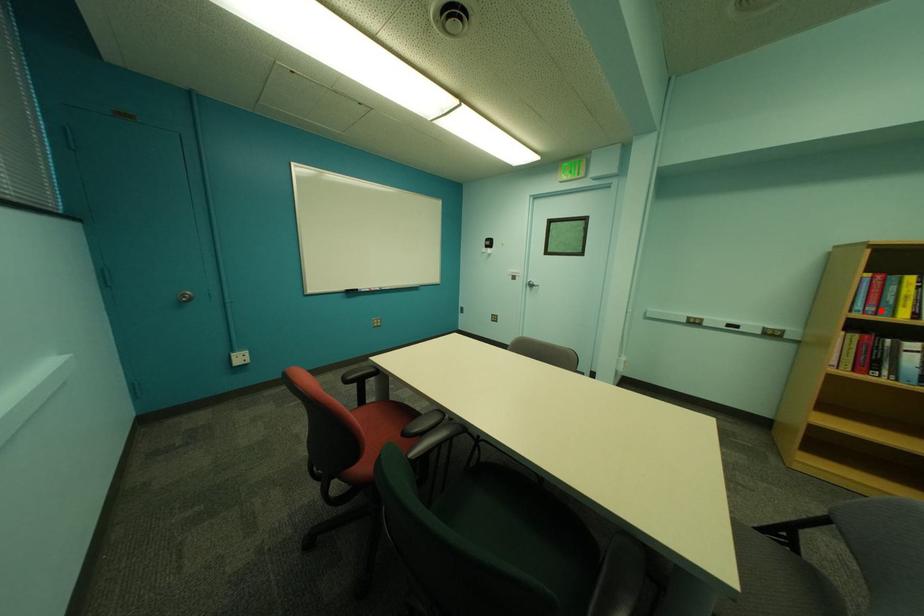
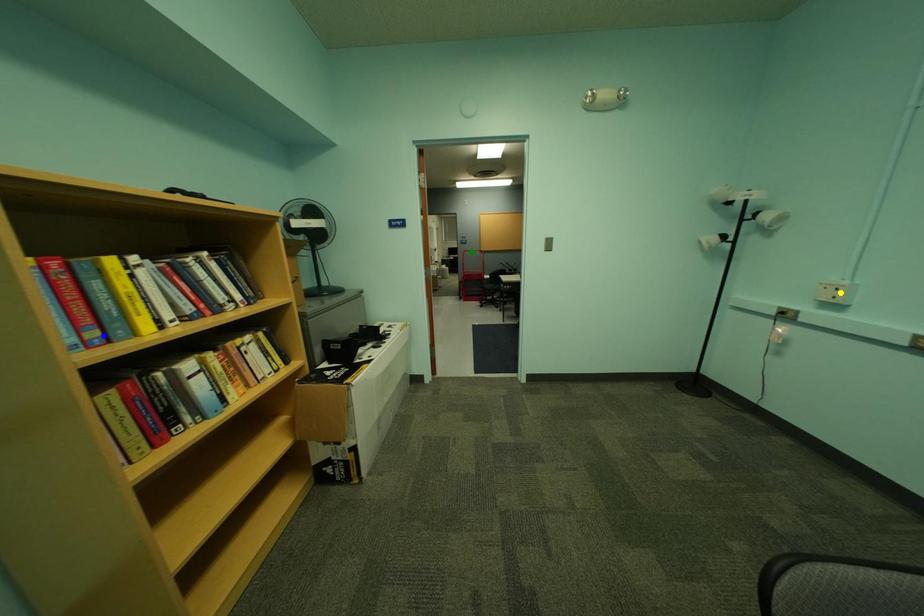
Question: I am providing you with two images of the same scene from different viewpoints. A red point is marked on the first image. You are given multiple points on the second image. Which point in image 2 represents the same 3d spot as the red point in image 1?

Choices:
 (A) blue point
 (B) green point
 (C) yellow point

Answer: (A)